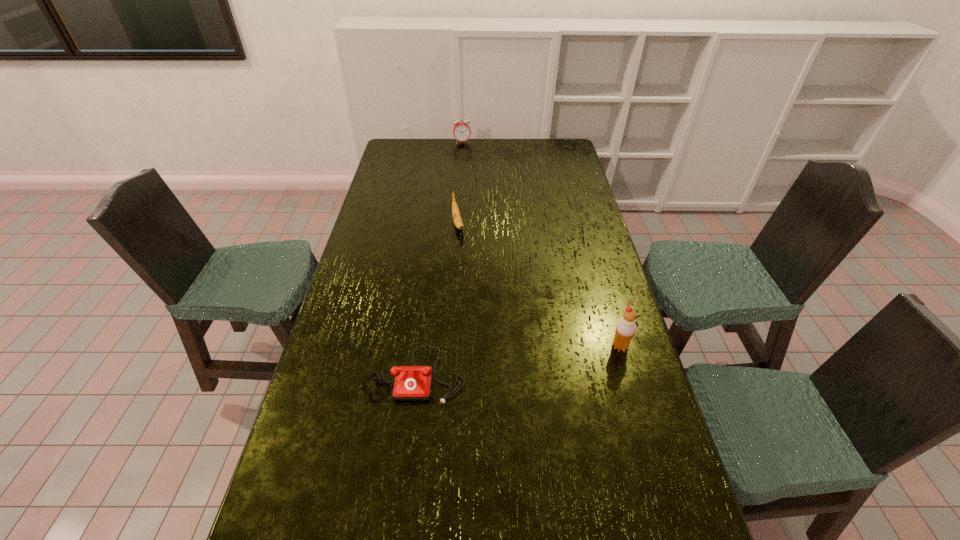
Where is `free space between the third nearest object and the telephone`? free space between the third nearest object and the telephone is located at coordinates (436, 299).

The width and height of the screenshot is (960, 540). Find the location of `free space between the telephone and the third tallest object`. free space between the telephone and the third tallest object is located at coordinates (436, 299).

Where is `empty location between the telephone and the second farthest object`? empty location between the telephone and the second farthest object is located at coordinates (436, 299).

Locate which object ranks third in proximity to the banana. Please provide its 2D coordinates. Your answer should be formatted as a tuple, i.e. [(x, y)], where the tuple contains the x and y coordinates of a point satisfying the conditions above.

[(625, 329)]

Point out which object is positioned as the third nearest to the icecream. Please provide its 2D coordinates. Your answer should be formatted as a tuple, i.e. [(x, y)], where the tuple contains the x and y coordinates of a point satisfying the conditions above.

[(461, 130)]

Image resolution: width=960 pixels, height=540 pixels. Find the location of `vacant space that satisfies the following two spatial constraints: 1. on the front side of the second farthest object; 2. on the left side of the farthest object`. vacant space that satisfies the following two spatial constraints: 1. on the front side of the second farthest object; 2. on the left side of the farthest object is located at coordinates (457, 224).